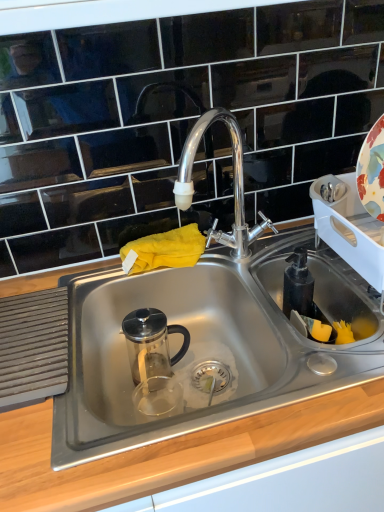
The image size is (384, 512). What do you see at coordinates (210, 335) in the screenshot?
I see `stainless steel sink at center` at bounding box center [210, 335].

Identify the location of stainless steel sink at center. The height and width of the screenshot is (512, 384). (210, 335).

Image resolution: width=384 pixels, height=512 pixels. What are the coordinates of `stainless steel sink at center` in the screenshot? It's located at (210, 335).